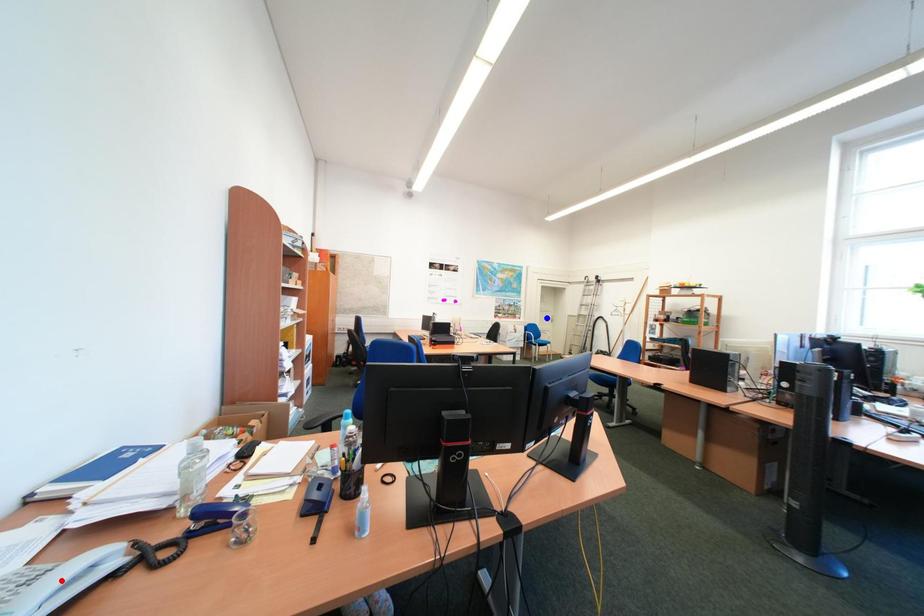
Question: Two points are marked on the image. Which point is closer to the camera?

Choices:
 (A) Blue point is closer.
 (B) Red point is closer.

Answer: (B)